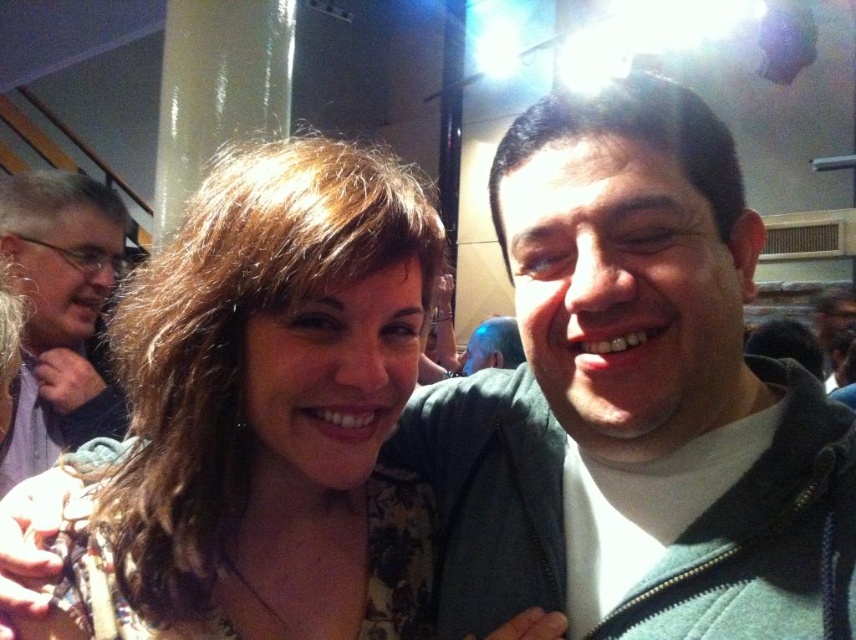
Question: Does green zip-up jacket at right have a lesser width compared to matte floral dress at center?

Choices:
 (A) no
 (B) yes

Answer: (A)

Question: Which of these objects is positioned closest to the blue metallic head at center?

Choices:
 (A) gray fabric shirt at left
 (B) matte floral dress at center

Answer: (A)

Question: Does matte floral dress at center have a larger size compared to gray fabric shirt at left?

Choices:
 (A) no
 (B) yes

Answer: (A)

Question: Which of the following is the closest to the observer?

Choices:
 (A) matte floral dress at center
 (B) green zip-up jacket at right
 (C) gray fabric shirt at left
 (D) blue metallic head at center

Answer: (B)

Question: Which is nearer to the matte floral dress at center?

Choices:
 (A) green zip-up jacket at right
 (B) blue metallic head at center

Answer: (A)

Question: Does green zip-up jacket at right appear on the left side of gray fabric shirt at left?

Choices:
 (A) yes
 (B) no

Answer: (B)